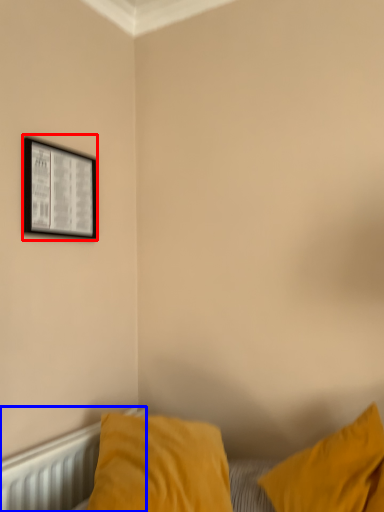
Question: Which point is further to the camera, picture frame (highlighted by a red box) or radiator (highlighted by a blue box)?

Choices:
 (A) picture frame
 (B) radiator

Answer: (A)